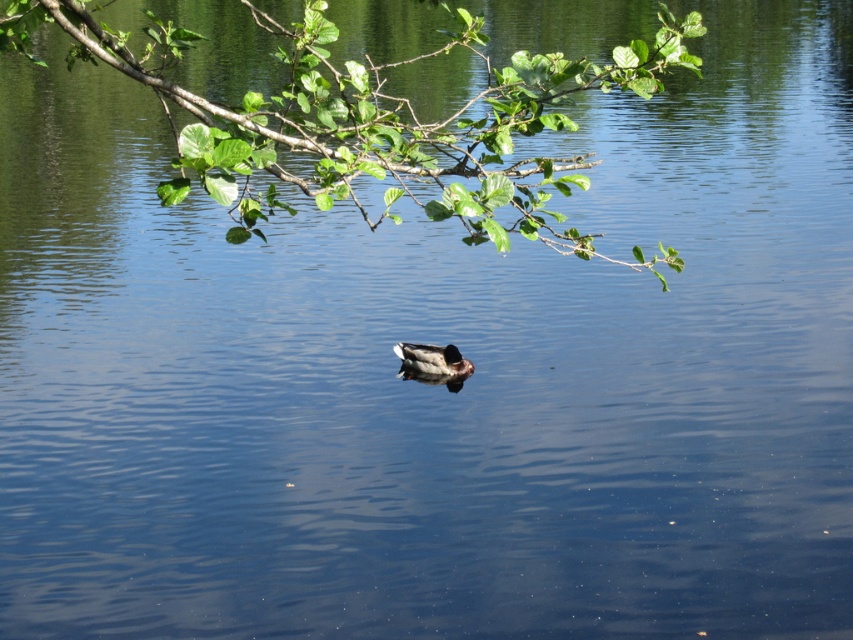
Question: Among these points, which one is nearest to the camera?

Choices:
 (A) (262, 118)
 (B) (451, 384)

Answer: (A)

Question: Considering the relative positions of green leafy branch at upper center and brown matte duck at center in the image provided, where is green leafy branch at upper center located with respect to brown matte duck at center?

Choices:
 (A) above
 (B) below

Answer: (A)

Question: Is green leafy branch at upper center below brown matte duck at center?

Choices:
 (A) yes
 (B) no

Answer: (B)

Question: Does green leafy branch at upper center appear on the left side of brown matte duck at center?

Choices:
 (A) yes
 (B) no

Answer: (B)